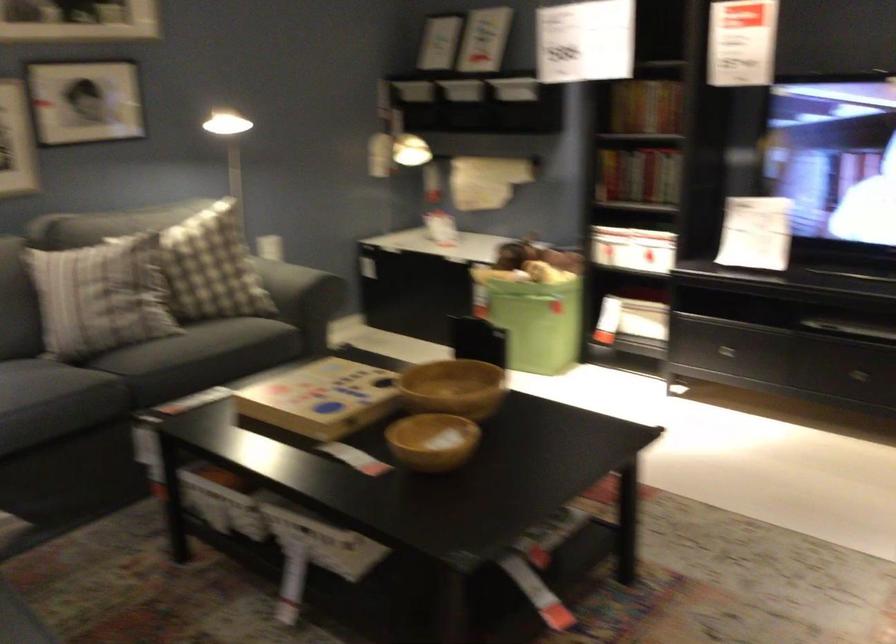
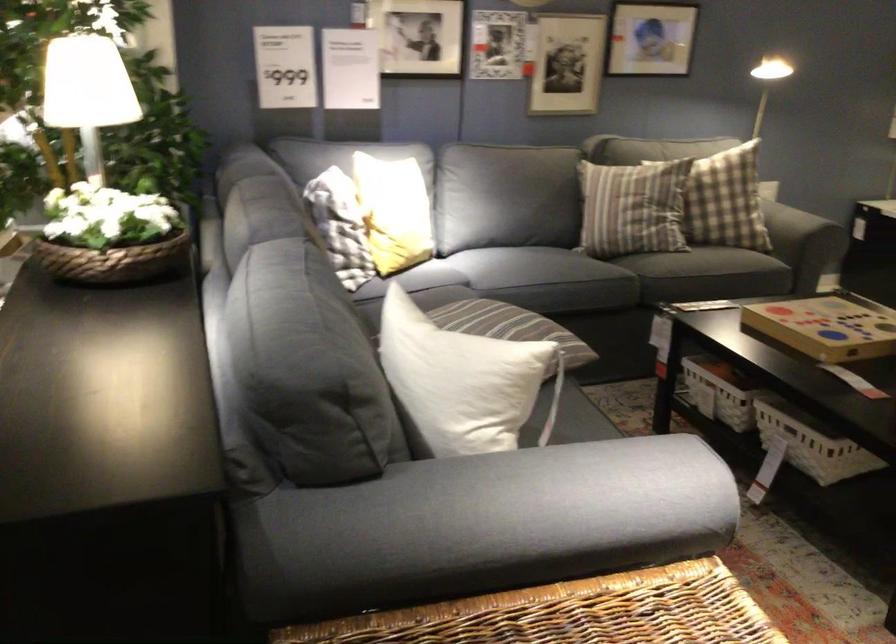
Question: I am providing you with two images of the same scene from different viewpoints. Which of the following objects are not visible in image2?

Choices:
 (A) yellow plant pot
 (B) sofa armrest
 (C) striped throw pillow
 (D) yellow throw pillow

Answer: (B)